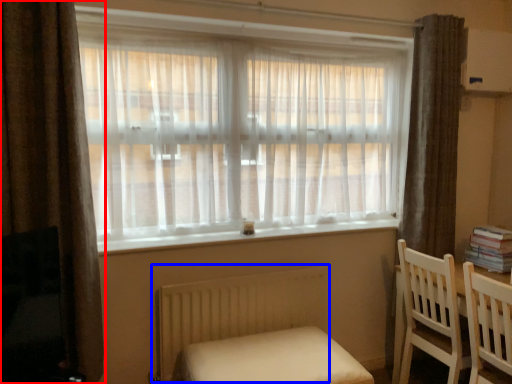
Question: Which object appears farthest to the camera in this image, curtain (highlighted by a red box) or radiator (highlighted by a blue box)?

Choices:
 (A) curtain
 (B) radiator

Answer: (B)